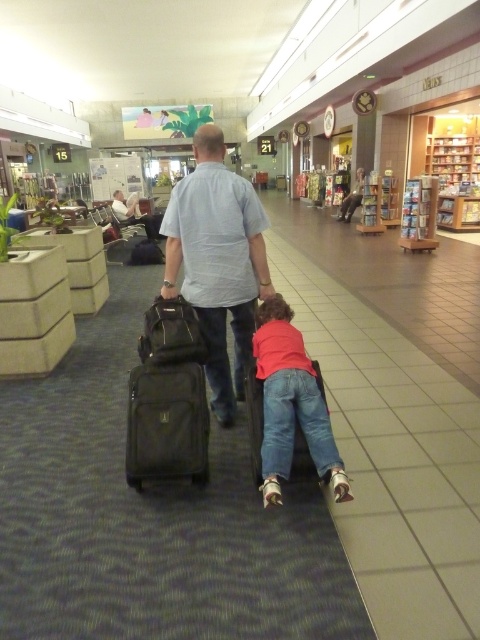
Question: Which object is the farthest from the matte pink shirt at center?

Choices:
 (A) light blue shirt at center
 (B) black fabric suitcase at center
 (C) matte black suitcase at center

Answer: (A)

Question: Which of these objects is positioned closest to the matte pink shirt at center?

Choices:
 (A) matte black suitcase at center
 (B) black fabric suitcase at center

Answer: (A)

Question: Which point is closer to the camera?

Choices:
 (A) matte pink shirt at center
 (B) matte black suitcase at center
 (C) black fabric suitcase at center

Answer: (A)

Question: Does light blue shirt at center appear over matte black suitcase at center?

Choices:
 (A) no
 (B) yes

Answer: (B)

Question: Can you confirm if black fabric suitcase at center is wider than matte black suitcase at center?

Choices:
 (A) no
 (B) yes

Answer: (B)

Question: Is the position of light blue shirt at center less distant than that of black fabric suitcase at center?

Choices:
 (A) no
 (B) yes

Answer: (A)